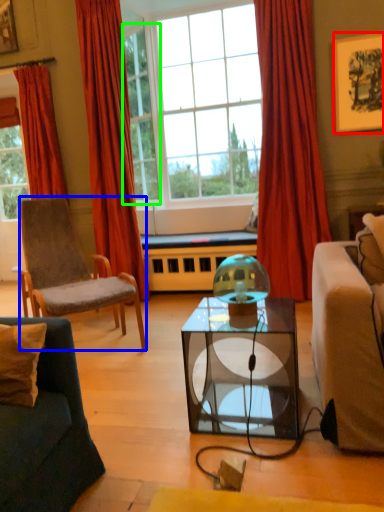
Question: Estimate the real-world distances between objects in this image. Which object is closer to picture frame (highlighted by a red box), chair (highlighted by a blue box) or window (highlighted by a green box)?

Choices:
 (A) chair
 (B) window

Answer: (B)